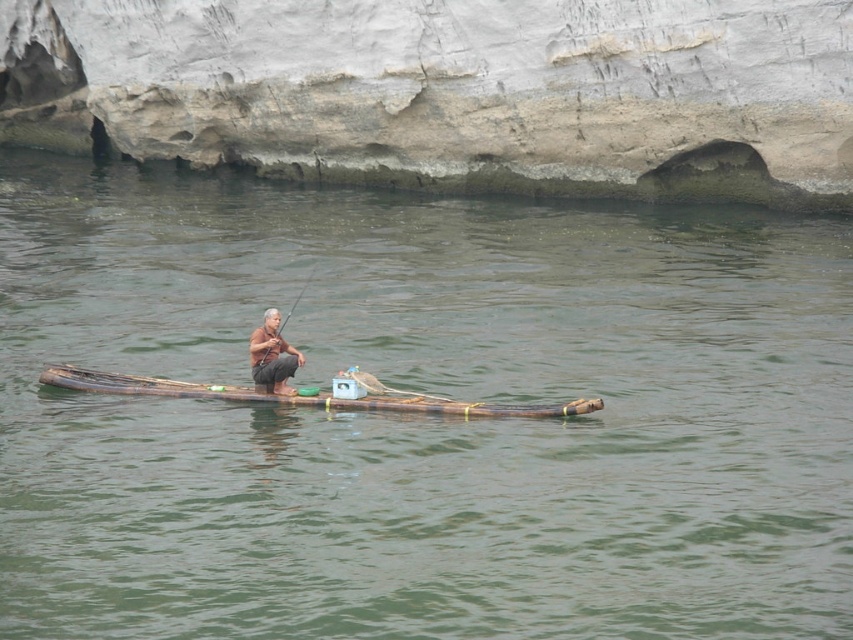
You are a tourist on a boat tour and see the brown wood boat at center and the brown matte fisherman at center. Which object is closer to you as you look at the scene?

The brown wood boat at center is closer to you because the brown matte fisherman at center is behind it.

You are a fisherman standing on the brown wood boat at center. You need to reach the wooden textured paddle at center to row the boat. Can you reach it without moving from your current position?

The brown wood boat at center and wooden textured paddle at center are 6.96 meters apart from each other, so you cannot reach the wooden textured paddle at center without moving from your current position because the distance is too far.